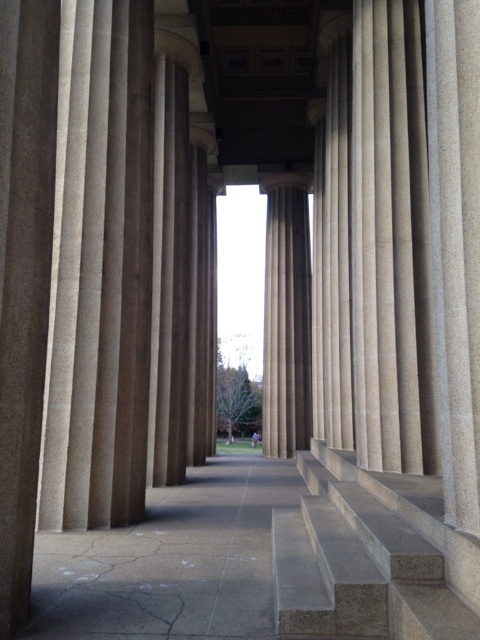
You are standing at the entrance of the colonnade and want to reach the smooth concrete stairs at center. Which direction should you walk to reach them?

You should walk forward towards the center of the colonnade to reach the smooth concrete stairs at center.

You are standing in the colonnade and want to walk towards the open sky. Which direction should you move relative to the gray concrete pavement at center and the sanded stone column at center?

You should move to the right side of the gray concrete pavement at center since it is positioned on the left side of the sanded stone column at center, and the open sky is at the end of the corridor formed by the columns.

You are standing in the colonnade looking towards the open sky. There are two points marked in the scene. The first point is at coordinates point (278,460) and the second is at point (294,372). Which point is closer to your current position?

Point (278,460) is closer to the camera than point (294,372), so the first point is closer to your current position.